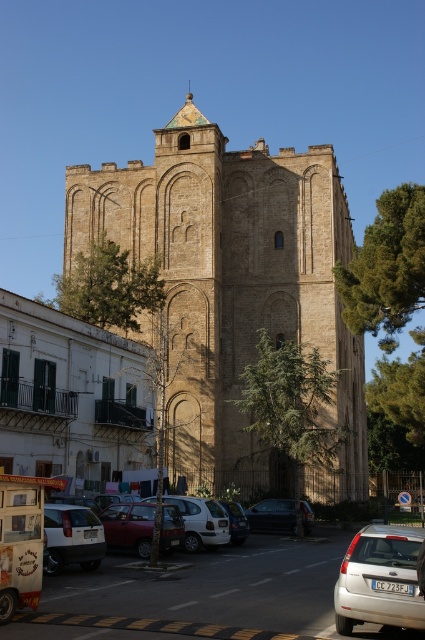
Question: Considering the relative positions of brown stone church at center and silver metallic car at center in the image provided, where is brown stone church at center located with respect to silver metallic car at center?

Choices:
 (A) below
 (B) above

Answer: (B)

Question: Estimate the real-world distances between objects in this image. Which object is closer to the dark gray metallic car at center?

Choices:
 (A) brown stone church at center
 (B) white matte car at lower left
 (C) silver metallic car at center
 (D) white matte car at center

Answer: (C)

Question: Based on their relative distances, which object is nearer to the dark gray metallic car at center?

Choices:
 (A) white matte car at lower left
 (B) brown stone church at center

Answer: (A)

Question: Observing the image, what is the correct spatial positioning of matte red car at center in reference to silver metallic car at center?

Choices:
 (A) left
 (B) right

Answer: (A)

Question: Does white matte car at lower left come behind white matte car at center?

Choices:
 (A) no
 (B) yes

Answer: (A)

Question: Estimate the real-world distances between objects in this image. Which object is closer to the brown stone church at center?

Choices:
 (A) silver metallic car at center
 (B) dark gray metallic car at center

Answer: (A)